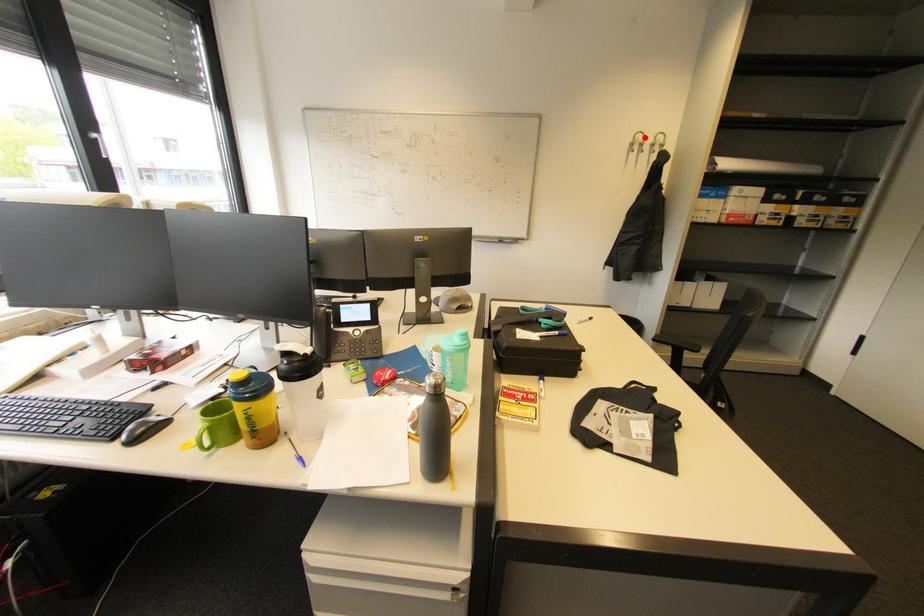
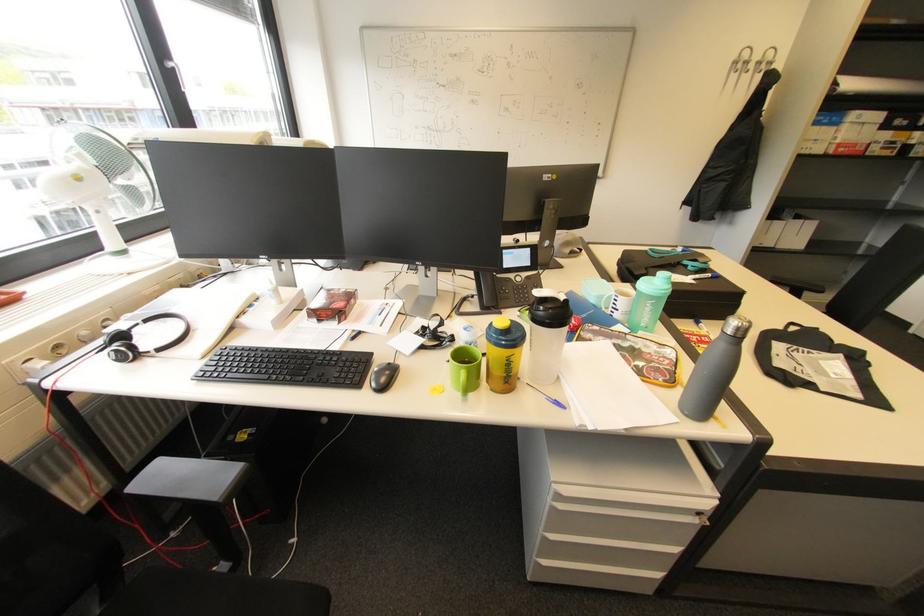
The point at the highlighted location is marked in the first image. Where is the corresponding point in the second image?

(751, 54)